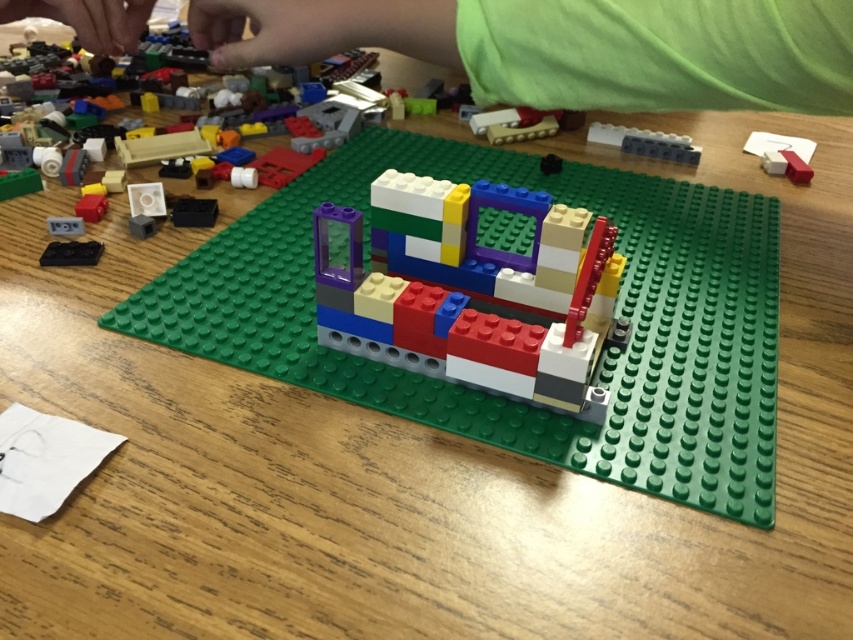
Describe the element at coordinates (469, 289) in the screenshot. The height and width of the screenshot is (640, 853). I see `multicolored plastic bricks at center` at that location.

Where is `multicolored plastic bricks at center`? Image resolution: width=853 pixels, height=640 pixels. multicolored plastic bricks at center is located at coordinates (469, 289).

Which of these two, green fabric arm at upper center or multicolored plastic bricks at center, stands shorter?

multicolored plastic bricks at center

Does green fabric arm at upper center appear under multicolored plastic bricks at center?

No, green fabric arm at upper center is not below multicolored plastic bricks at center.

Measure the distance between green fabric arm at upper center and camera.

green fabric arm at upper center is 23.27 inches away from camera.

Where is `green fabric arm at upper center`? This screenshot has width=853, height=640. green fabric arm at upper center is located at coordinates (569, 48).

Does gray matte brick at upper right appear on the right side of translucent purple plastic at upper left?

Correct, you'll find gray matte brick at upper right to the right of translucent purple plastic at upper left.

Is gray matte brick at upper right below translucent purple plastic at upper left?

Correct, gray matte brick at upper right is located below translucent purple plastic at upper left.

Between point (590, 124) and point (161, 141), which one is positioned in front?

Point (161, 141) is more forward.

The height and width of the screenshot is (640, 853). I want to click on gray matte brick at upper right, so click(645, 141).